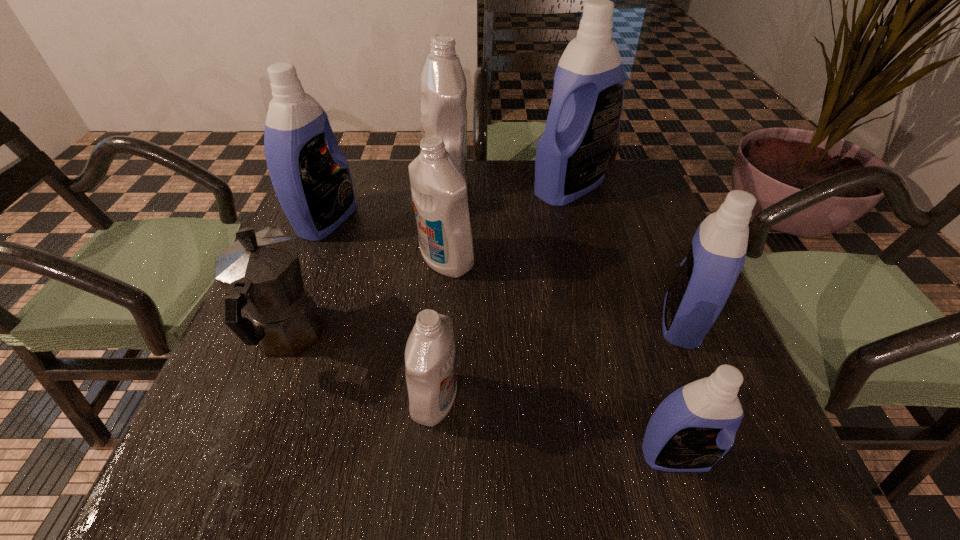
At what (x,y) coordinates should I click in order to perform the action: click on the biggest blue detergent. Please return your answer as a coordinate pair (x, y). Looking at the image, I should click on (572, 155).

Find the location of a particular element. the tallest object is located at coordinates (572, 155).

The height and width of the screenshot is (540, 960). In order to click on the farthest white detergent in this screenshot , I will do `click(443, 84)`.

You are a GUI agent. You are given a task and a screenshot of the screen. Output one action in this format:
    pyautogui.click(x=<x>, y=<y>)
    Task: Click on the leftmost detergent
    
    Given the screenshot: What is the action you would take?
    pyautogui.click(x=313, y=184)

Locate an element on the screen. This screenshot has width=960, height=540. the leftmost blue detergent is located at coordinates (313, 184).

The width and height of the screenshot is (960, 540). In order to click on the second nearest white detergent in this screenshot , I will do `click(439, 191)`.

Locate an element on the screen. This screenshot has height=540, width=960. the third nearest detergent is located at coordinates (705, 278).

In order to click on the second nearest blue detergent in this screenshot , I will do `click(705, 278)`.

I want to click on coffeepot, so click(x=260, y=272).

You are a GUI agent. You are given a task and a screenshot of the screen. Output one action in this format:
    pyautogui.click(x=<x>, y=<y>)
    Task: Click on the nearest white detergent
    This screenshot has width=960, height=540.
    Given the screenshot: What is the action you would take?
    pyautogui.click(x=430, y=360)